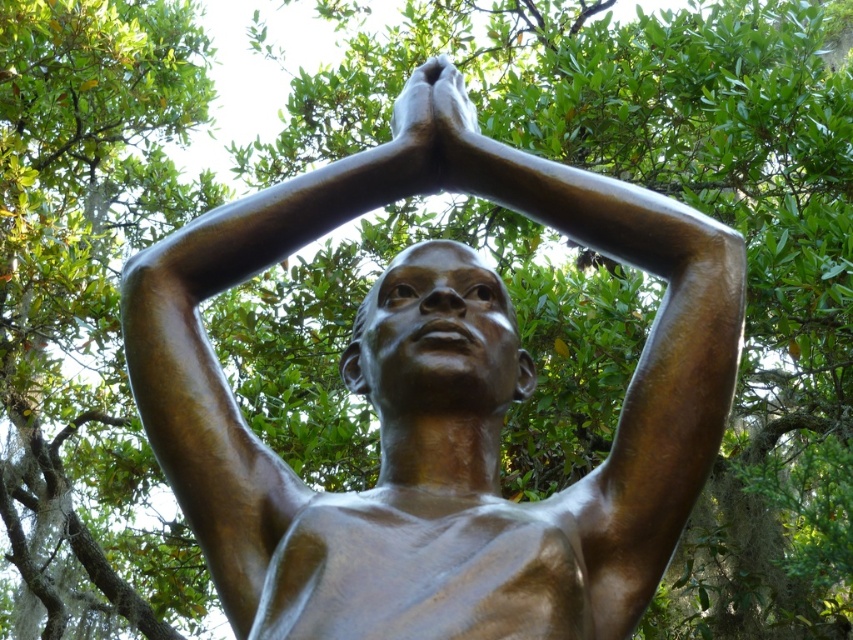
You are standing in a park and see the bronze statue at center. If you want to locate it precisely on a map, what are its coordinates?

The bronze statue at center is located at coordinates point (437, 410).